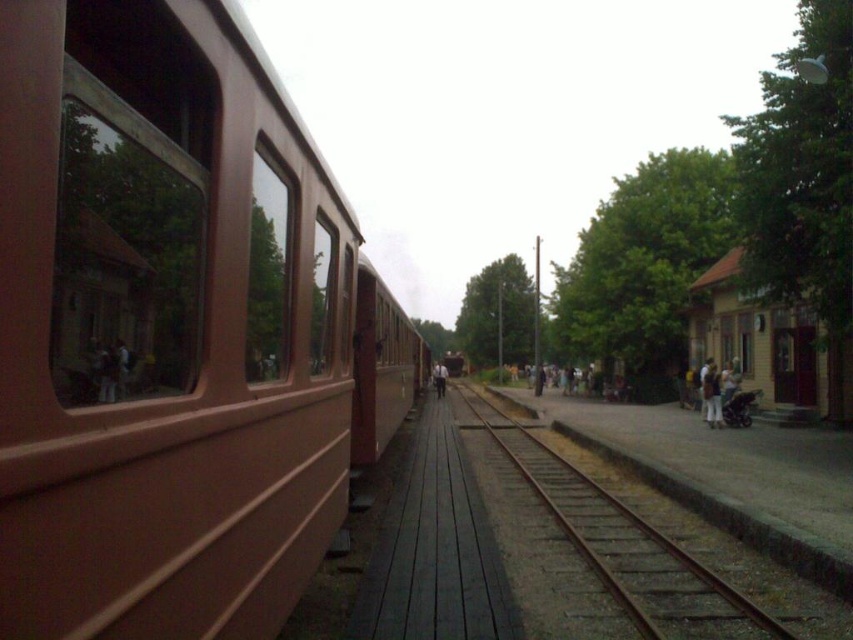
Can you confirm if brown matte train at left is thinner than light brown leather jacket at center?

Correct, brown matte train at left's width is less than light brown leather jacket at center's.

Who is higher up, brown matte train at left or light brown leather jacket at center?

brown matte train at left is higher up.

Does point (4, 150) lie behind point (440, 362)?

No, (4, 150) is in front of (440, 362).

In order to click on brown matte train at left in this screenshot , I will do `click(164, 326)`.

Is the position of light brown fabric pants at lower right more distant than that of light brown leather jacket at center?

No.

Does light brown fabric pants at lower right have a greater height compared to light brown leather jacket at center?

In fact, light brown fabric pants at lower right may be shorter than light brown leather jacket at center.

Image resolution: width=853 pixels, height=640 pixels. Identify the location of light brown fabric pants at lower right. (711, 394).

Who is positioned more to the left, brown metal train track at center or light brown leather jacket at center?

From the viewer's perspective, light brown leather jacket at center appears more on the left side.

Does brown metal train track at center come in front of light brown leather jacket at center?

Yes, it is in front of light brown leather jacket at center.

Is point (703, 605) positioned behind point (439, 362)?

No, it is not.

You are a GUI agent. You are given a task and a screenshot of the screen. Output one action in this format:
    pyautogui.click(x=<x>, y=<y>)
    Task: Click on the brown metal train track at center
    The width and height of the screenshot is (853, 640).
    Given the screenshot: What is the action you would take?
    pyautogui.click(x=627, y=547)